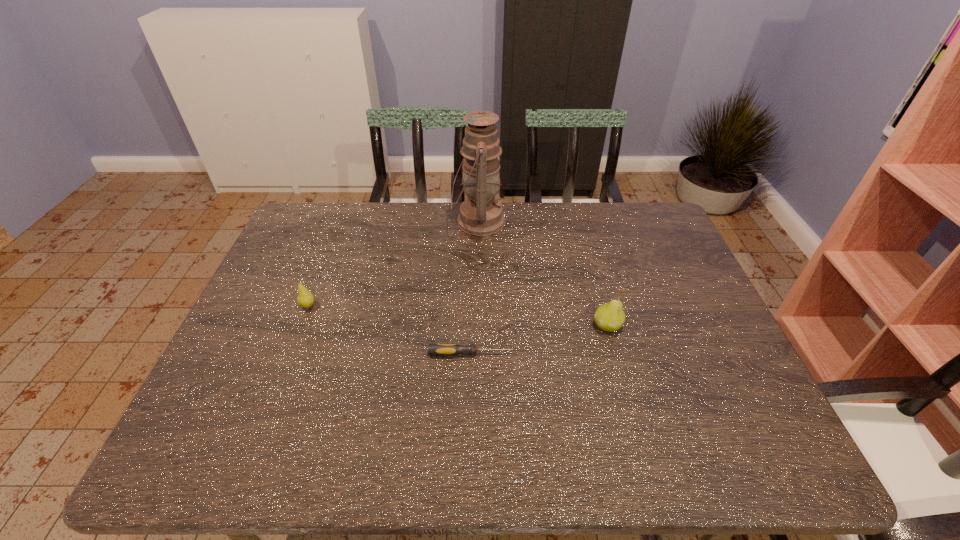
Where is `free area in between the screwdriver and the tallest object`? free area in between the screwdriver and the tallest object is located at coordinates (475, 287).

The width and height of the screenshot is (960, 540). Identify the location of free area in between the screwdriver and the left pear. (390, 330).

The image size is (960, 540). Identify the location of empty space that is in between the oil lamp and the farther pear. (394, 264).

Identify the location of free space that is in between the rightmost object and the shorter pear. (458, 316).

You are a GUI agent. You are given a task and a screenshot of the screen. Output one action in this format:
    pyautogui.click(x=<x>, y=<y>)
    Task: Click on the vacant region between the farthest object and the nearer pear
    This screenshot has width=960, height=540.
    Given the screenshot: What is the action you would take?
    pyautogui.click(x=542, y=273)

The height and width of the screenshot is (540, 960). I want to click on vacant point located between the farther pear and the nearest object, so click(390, 330).

You are a GUI agent. You are given a task and a screenshot of the screen. Output one action in this format:
    pyautogui.click(x=<x>, y=<y>)
    Task: Click on the free space between the nearer pear and the farther pear
    
    Given the screenshot: What is the action you would take?
    pyautogui.click(x=458, y=316)

Find the location of `free point between the tallest object and the left pear`. free point between the tallest object and the left pear is located at coordinates (394, 264).

Find the location of `free space that is in between the screwdriver and the leftmost object`. free space that is in between the screwdriver and the leftmost object is located at coordinates (390, 330).

The image size is (960, 540). Find the location of `vacant area between the left pear and the oil lamp`. vacant area between the left pear and the oil lamp is located at coordinates (394, 264).